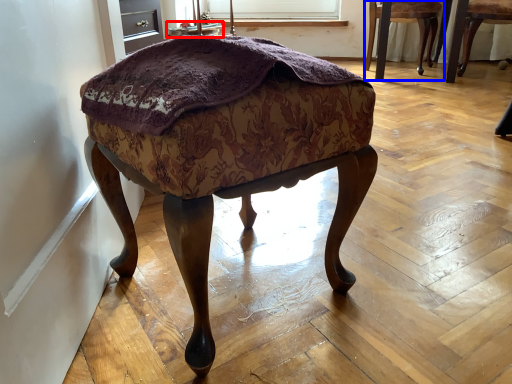
Question: Which point is closer to the camera, side table (highlighted by a red box) or chair (highlighted by a blue box)?

Choices:
 (A) side table
 (B) chair

Answer: (B)